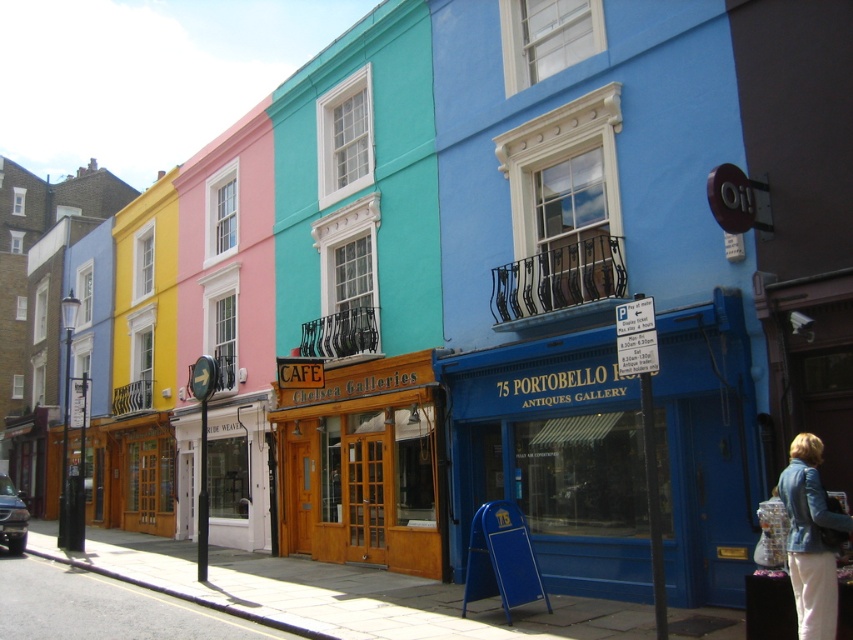
Who is higher up, blue matte building at center or wooden door at center?

blue matte building at center is above.

Is point (677, 561) farther from viewer compared to point (412, 477)?

No, (677, 561) is closer to viewer.

Locate an element on the screen. blue matte building at center is located at coordinates (555, 456).

Which is behind, point (419, 541) or point (819, 483)?

Positioned behind is point (419, 541).

Who is positioned more to the left, wooden door at center or denim jacket at lower right?

wooden door at center

Where is `wooden door at center`? This screenshot has width=853, height=640. wooden door at center is located at coordinates (364, 465).

Which is more to the right, blue matte building at center or denim jacket at lower right?

Positioned to the right is denim jacket at lower right.

Does point (595, 534) lie behind point (810, 536)?

Yes.

The image size is (853, 640). I want to click on blue matte building at center, so click(x=555, y=456).